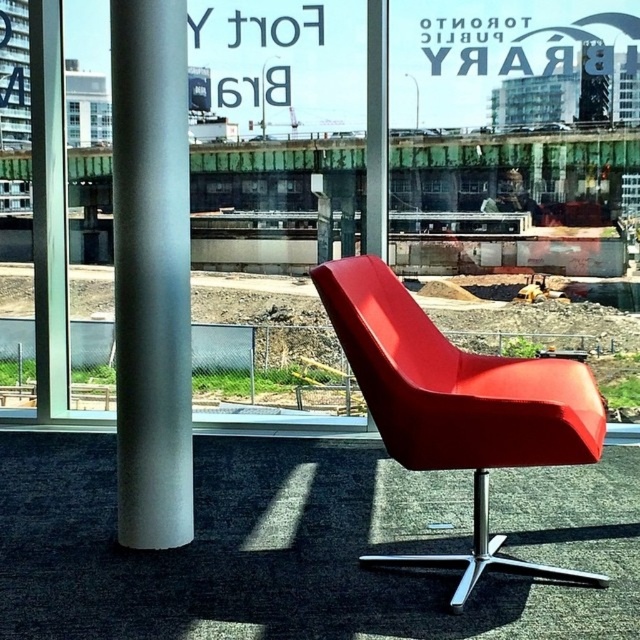
Based on the photo, who is taller, satin silver pole at left or matte red swivel chair at center?

satin silver pole at left is taller.

Does satin silver pole at left have a larger size compared to matte red swivel chair at center?

Incorrect, satin silver pole at left is not larger than matte red swivel chair at center.

Is point (115, 77) farther from viewer compared to point (356, 326)?

That is True.

I want to click on satin silver pole at left, so click(150, 273).